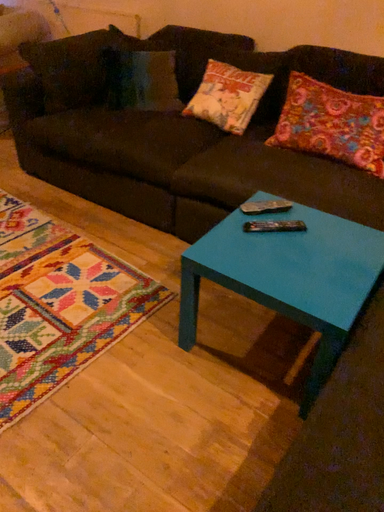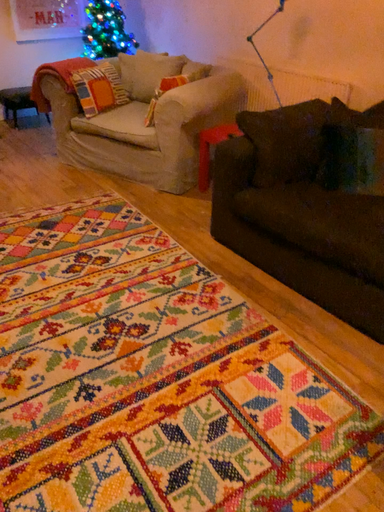
Question: Which way did the camera rotate in the video?

Choices:
 (A) rotated upward
 (B) rotated downward

Answer: (A)